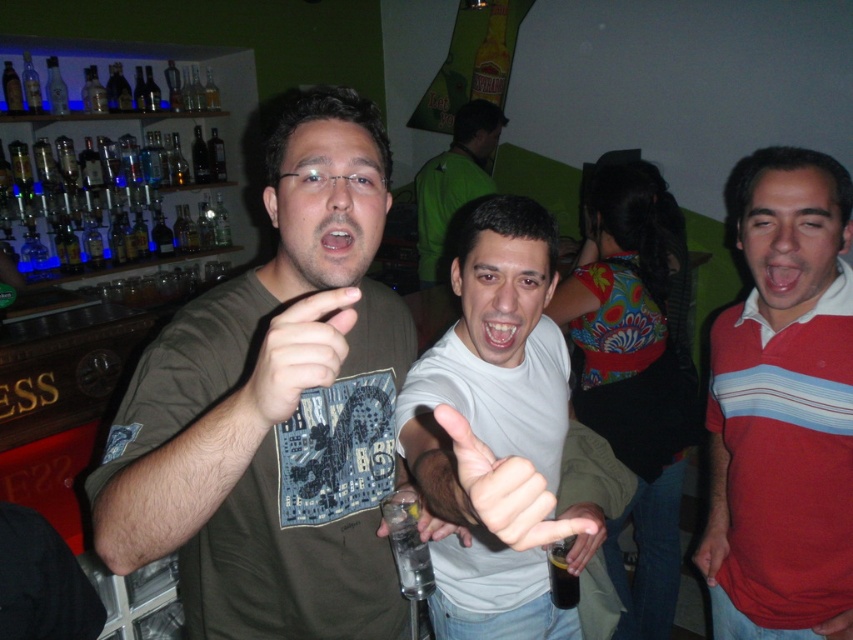
Is gray matte hand at center shorter than matte plastic bottle at lower center?

Indeed, gray matte hand at center has a lesser height compared to matte plastic bottle at lower center.

The width and height of the screenshot is (853, 640). Describe the element at coordinates (503, 490) in the screenshot. I see `gray matte hand at center` at that location.

Is point (492, 477) more distant than point (590, 516)?

That is False.

Locate an element on the screen. gray matte hand at center is located at coordinates (503, 490).

Does gray matte hand at center appear on the right side of green matte shirt at center?

Correct, you'll find gray matte hand at center to the right of green matte shirt at center.

Is gray matte hand at center to the left of green matte shirt at center from the viewer's perspective?

No, gray matte hand at center is not to the left of green matte shirt at center.

Which is behind, point (498, 525) or point (471, 122)?

Positioned behind is point (471, 122).

Where is `gray matte hand at center`? This screenshot has width=853, height=640. gray matte hand at center is located at coordinates (503, 490).

Can you confirm if green matte shirt at center is thinner than clear plastic glass at center?

In fact, green matte shirt at center might be wider than clear plastic glass at center.

Who is more forward, (463, 188) or (436, 520)?

Point (436, 520) is in front.

Where is `green matte shirt at center`? green matte shirt at center is located at coordinates (454, 180).